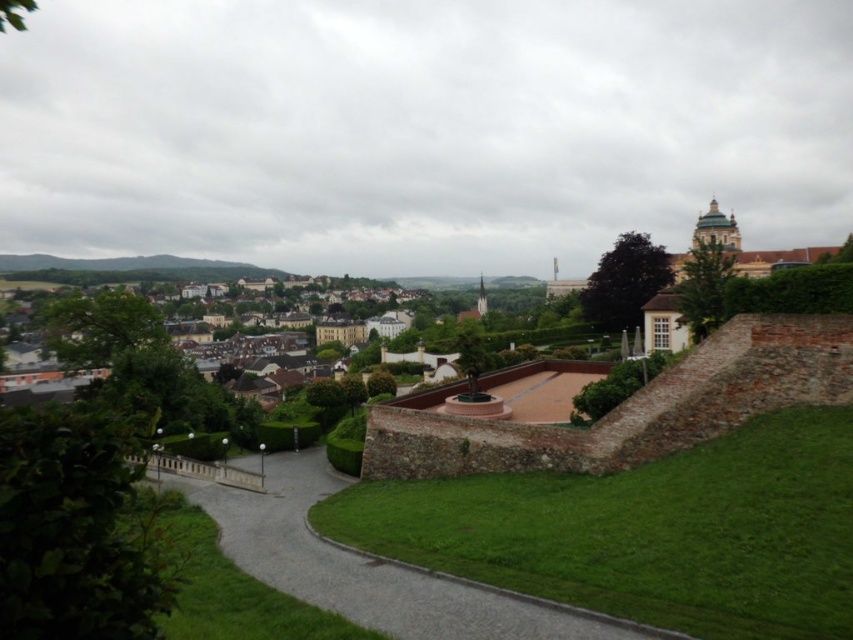
Does paved stone path at lower center have a greater height compared to brown stone buildings at center?

Incorrect, paved stone path at lower center's height is not larger of brown stone buildings at center's.

Is paved stone path at lower center shorter than brown stone buildings at center?

Yes, paved stone path at lower center is shorter than brown stone buildings at center.

Identify the location of paved stone path at lower center. (363, 561).

Find the location of a particular element. The width and height of the screenshot is (853, 640). paved stone path at lower center is located at coordinates (363, 561).